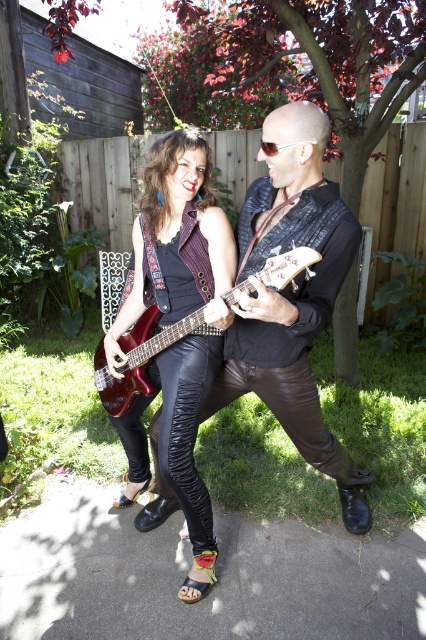
Is shiny black guitar at center above metallic red electric guitar at center?

No, shiny black guitar at center is not above metallic red electric guitar at center.

Which is more to the right, shiny black guitar at center or metallic red electric guitar at center?

shiny black guitar at center is more to the right.

Describe the element at coordinates (291, 296) in the screenshot. I see `shiny black guitar at center` at that location.

Locate an element on the screen. The height and width of the screenshot is (640, 426). shiny black guitar at center is located at coordinates (291, 296).

Between shiny black leather pants at center and metallic red electric guitar at center, which one appears on the left side from the viewer's perspective?

shiny black leather pants at center is more to the left.

Is shiny black leather pants at center shorter than metallic red electric guitar at center?

No.

You are a GUI agent. You are given a task and a screenshot of the screen. Output one action in this format:
    pyautogui.click(x=<x>, y=<y>)
    Task: Click on the shiny black leather pants at center
    Image resolution: width=426 pixels, height=640 pixels.
    Given the screenshot: What is the action you would take?
    pyautogui.click(x=180, y=300)

Does point (337, 243) come farther from viewer compared to point (210, 241)?

No, it is not.

Who is taller, shiny black guitar at center or shiny black leather pants at center?

Standing taller between the two is shiny black guitar at center.

Does point (204, 406) come behind point (112, 364)?

No, (204, 406) is closer to viewer.

Locate an element on the screen. The height and width of the screenshot is (640, 426). shiny black guitar at center is located at coordinates (291, 296).